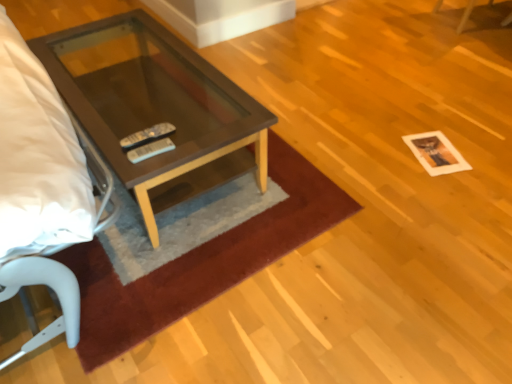
The image size is (512, 384). I want to click on free spot in front of white paper at lower right, so click(x=444, y=187).